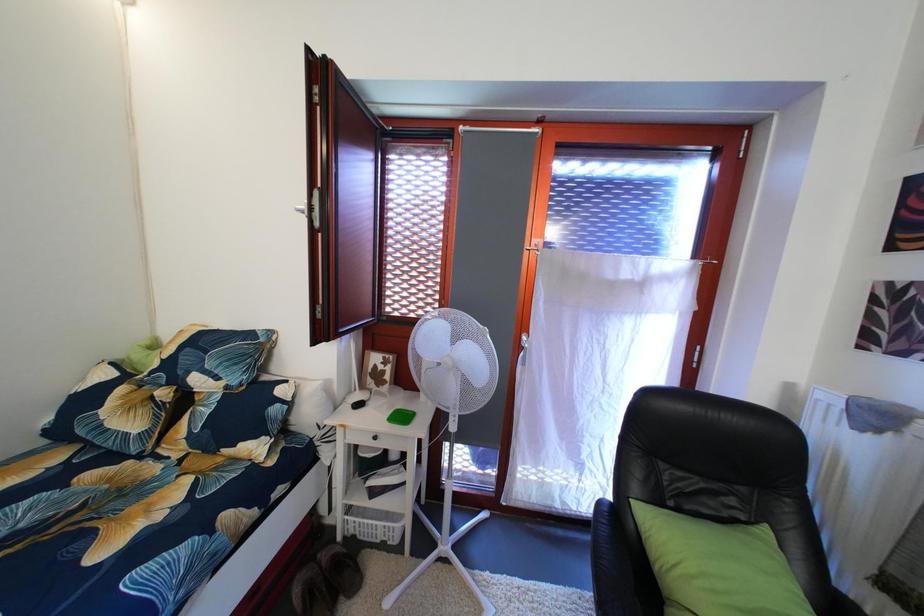
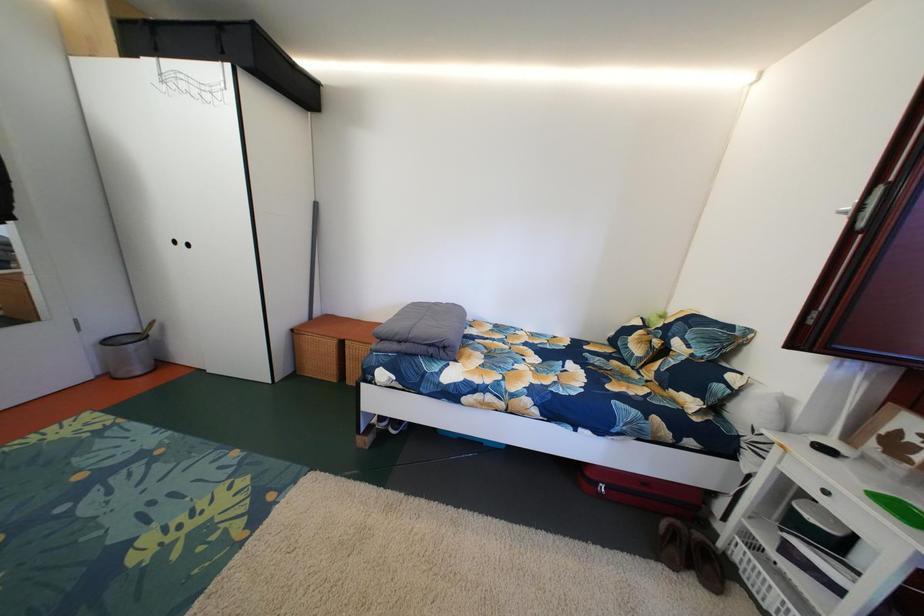
Question: The camera is either moving clockwise (left) or counter-clockwise (right) around the object. The first image is from the beginning of the video and the second image is from the end. Is the camera moving left or right when shooting the video?

Choices:
 (A) Left
 (B) Right

Answer: (B)